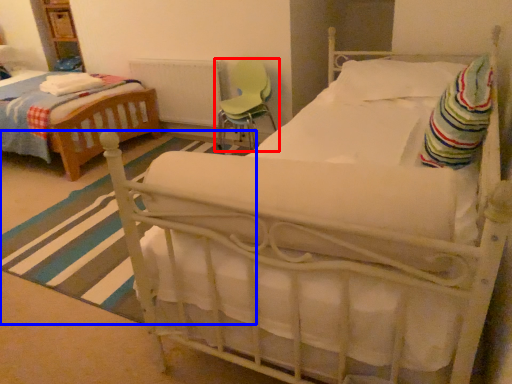
Question: Among these objects, which one is nearest to the camera, chair (highlighted by a red box) or stripe (highlighted by a blue box)?

Choices:
 (A) chair
 (B) stripe

Answer: (B)